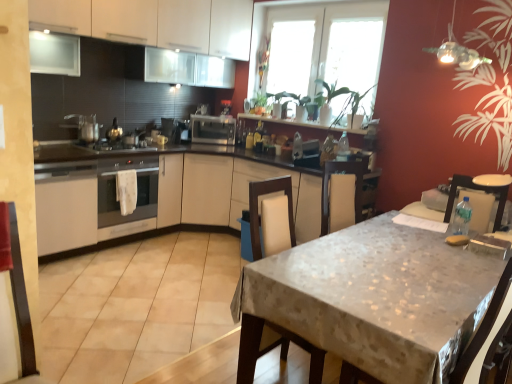
The image size is (512, 384). I want to click on vacant space to the left of textured beige table at center, so click(155, 329).